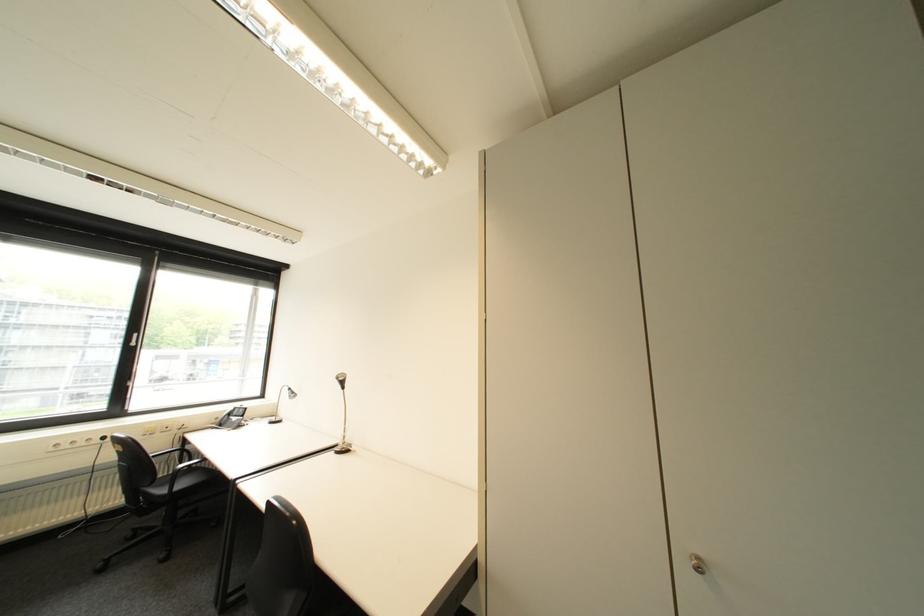
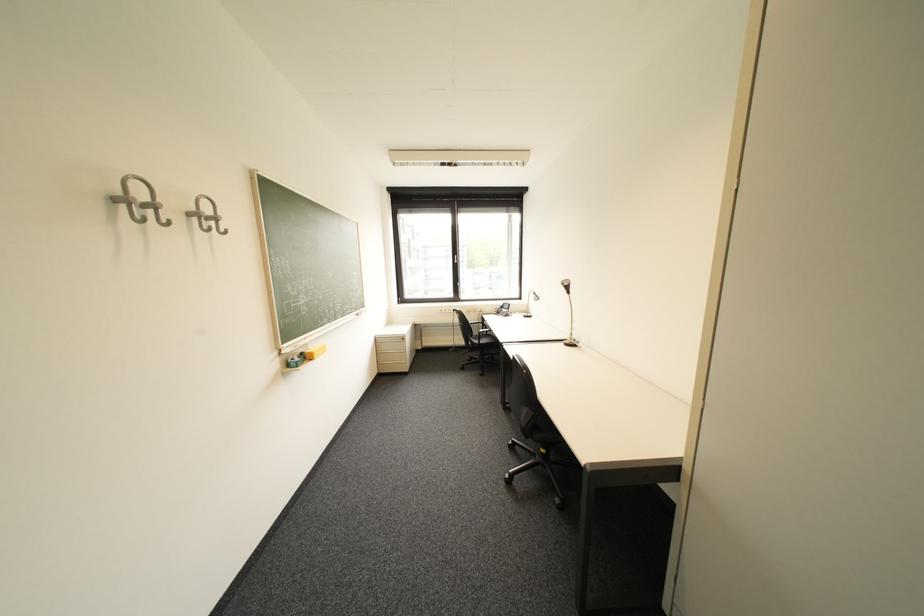
Locate, in the second image, the point that corresponds to point 191,466 in the first image.

(492, 331)